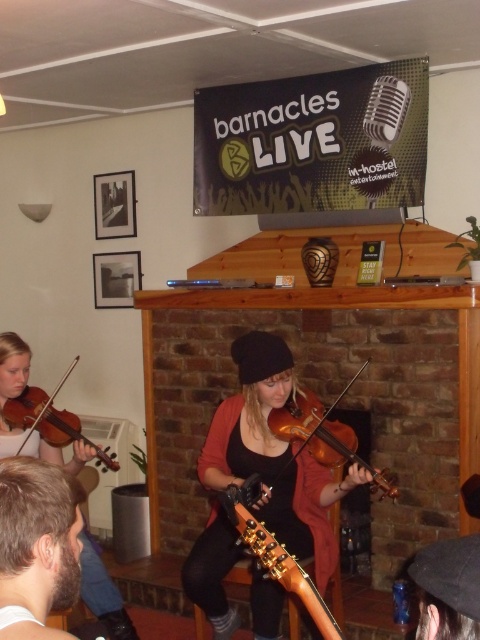
Question: Which of the following is the farthest from the observer?

Choices:
 (A) (323, 444)
 (B) (35, 500)

Answer: (A)

Question: Among these points, which one is farthest from the camera?

Choices:
 (A) (45, 410)
 (B) (232, 356)
 (C) (326, 451)

Answer: (A)

Question: Is the position of matte brown violin at center less distant than that of wooden violin at center?

Choices:
 (A) yes
 (B) no

Answer: (A)

Question: Which point is closer to the camera?

Choices:
 (A) matte black violin at center
 (B) bearded man at lower left
 (C) matte brown violin at left

Answer: (B)

Question: Can you confirm if matte black violin at center is positioned to the left of matte brown violin at left?

Choices:
 (A) no
 (B) yes

Answer: (B)

Question: Does bearded man at lower left come behind matte brown violin at left?

Choices:
 (A) yes
 (B) no

Answer: (B)